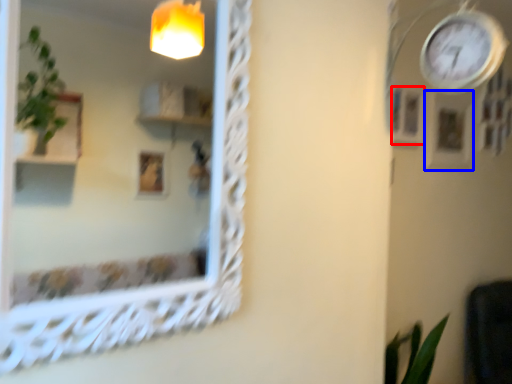
Question: Which point is closer to the camera, picture frame (highlighted by a red box) or picture frame (highlighted by a blue box)?

Choices:
 (A) picture frame
 (B) picture frame

Answer: (A)